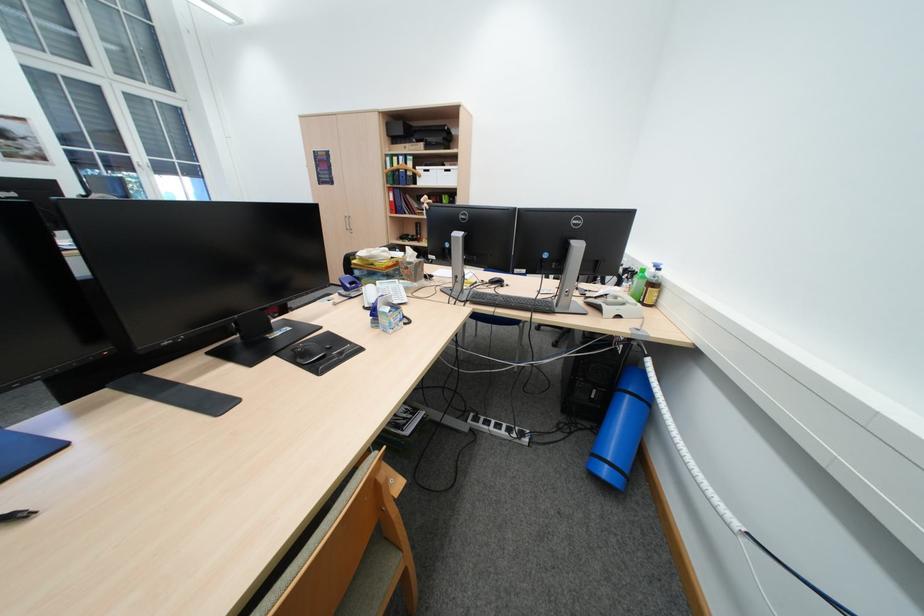
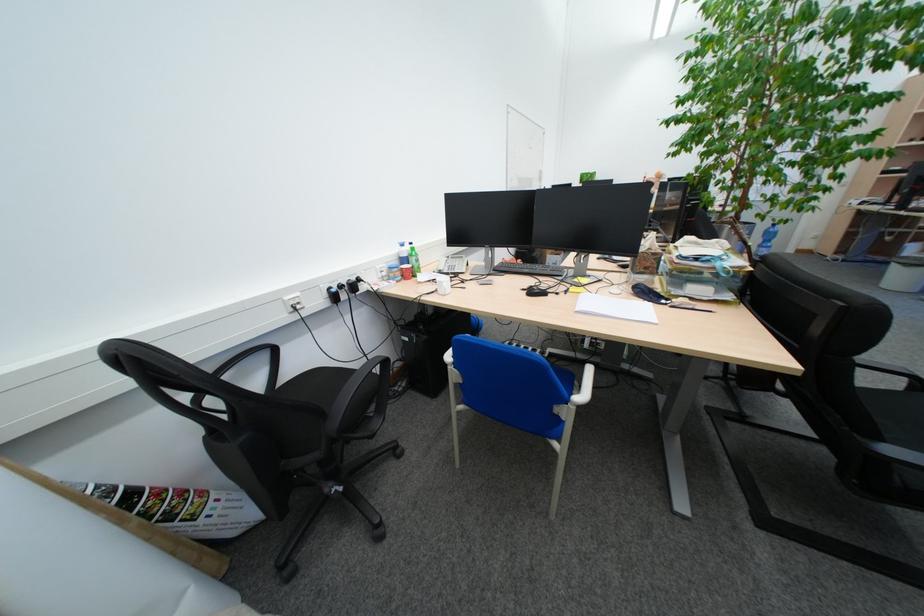
Question: I am providing you with two images of the same scene from different viewpoints. Please identify which objects are invisible in image2.

Choices:
 (A) green plastic bottle
 (B) orange circular magnet
 (C) water bottle
 (D) green label bottle

Answer: (A)